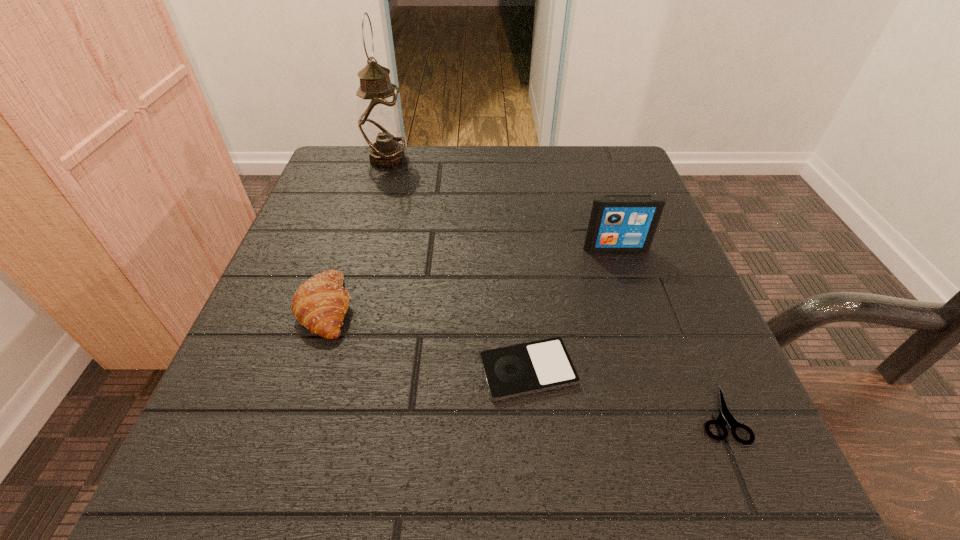
Locate an element on the screen. The height and width of the screenshot is (540, 960). free spot between the crescent roll and the second farthest object is located at coordinates (x=471, y=277).

Locate an element on the screen. free space that is in between the crescent roll and the third object from right to left is located at coordinates (427, 339).

This screenshot has height=540, width=960. I want to click on vacant area between the crescent roll and the oil lamp, so click(x=357, y=233).

I want to click on vacant space that's between the shears and the tallest object, so click(x=554, y=287).

This screenshot has width=960, height=540. Find the location of `free space between the crescent roll and the left iPod`. free space between the crescent roll and the left iPod is located at coordinates (427, 339).

In order to click on empty space that is in between the shortest object and the right iPod in this screenshot , I will do `click(668, 331)`.

You are a GUI agent. You are given a task and a screenshot of the screen. Output one action in this format:
    pyautogui.click(x=<x>, y=<y>)
    Task: Click on the third closest object relative to the farther iPod
    
    Given the screenshot: What is the action you would take?
    pyautogui.click(x=320, y=304)

At what (x,y) coordinates should I click in order to perform the action: click on object that stands as the second closest to the second farthest object. Please return your answer as a coordinate pair (x, y). The image size is (960, 540). Looking at the image, I should click on (725, 416).

Where is `free spot that satisfies the following two spatial constraints: 1. on the back side of the crescent roll; 2. on the right side of the tallest object`? Image resolution: width=960 pixels, height=540 pixels. free spot that satisfies the following two spatial constraints: 1. on the back side of the crescent roll; 2. on the right side of the tallest object is located at coordinates (374, 160).

Image resolution: width=960 pixels, height=540 pixels. What are the coordinates of `vacant space that satisfies the following two spatial constraints: 1. on the front side of the shorter iPod; 2. on the left side of the shortest object` in the screenshot? It's located at (532, 414).